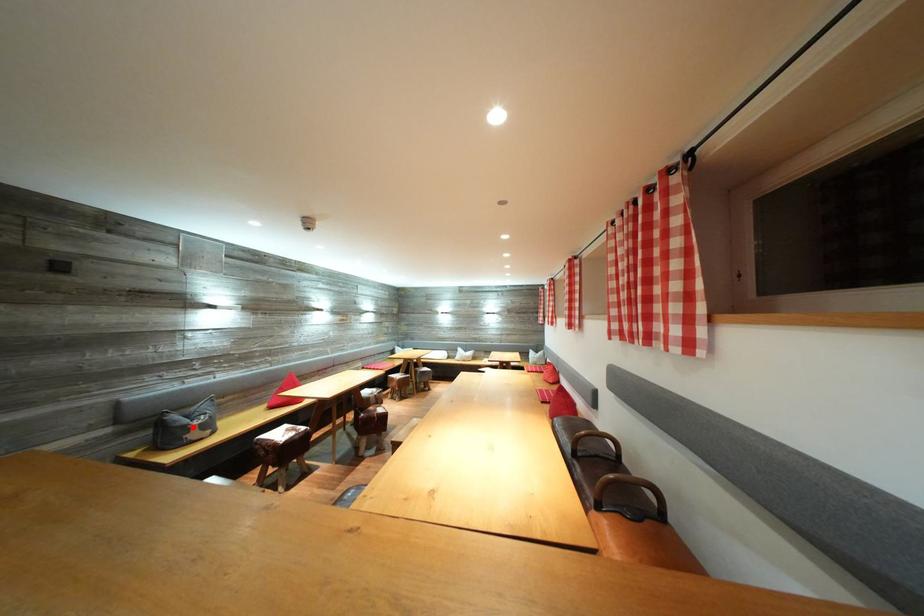
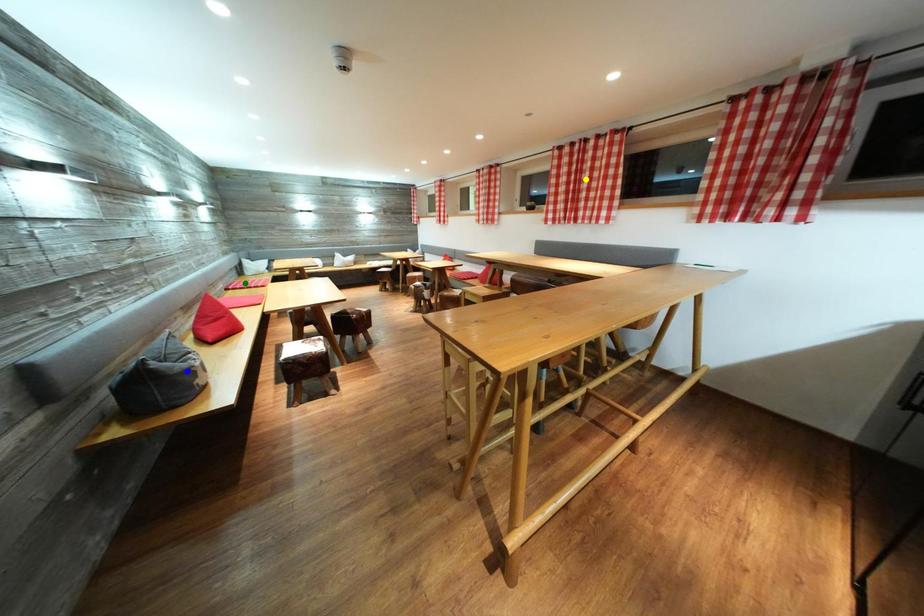
Question: I am providing you with two images of the same scene from different viewpoints. A red point is marked on the first image. You are given multiple points on the second image. In image 2, which mark is for the same physical point as the one in image 1?

Choices:
 (A) green point
 (B) blue point
 (C) yellow point

Answer: (B)